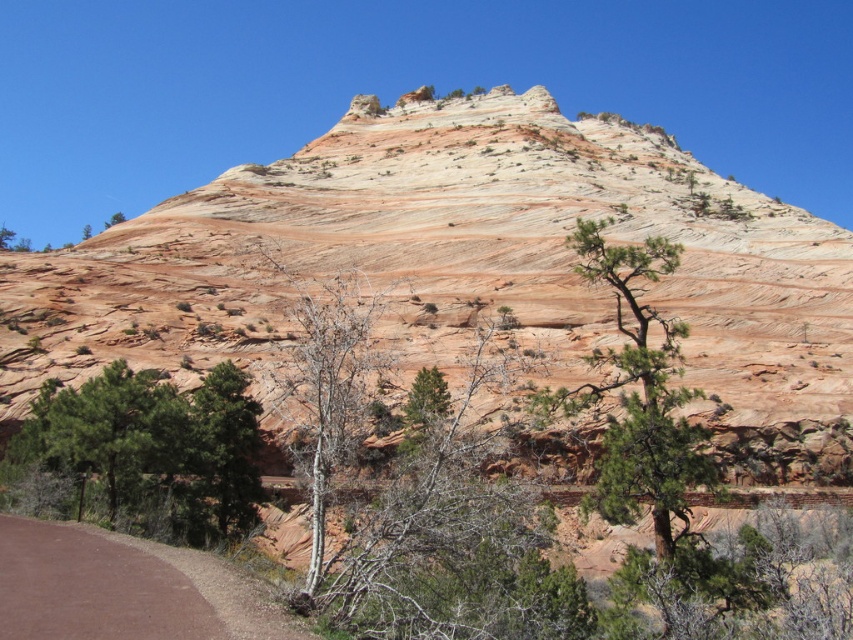
Question: Among these points, which one is nearest to the camera?

Choices:
 (A) (233, 520)
 (B) (610, 488)
 (C) (186, 292)

Answer: (B)

Question: Which of these objects is positioned farthest from the rustic sandstone mountain at center?

Choices:
 (A) bare wood tree at center
 (B) brown dirt path at lower left
 (C) green textured tree at center
 (D) green leafy tree at lower left

Answer: (B)

Question: Where is green matte tree at lower left located in relation to green textured tree at center in the image?

Choices:
 (A) below
 (B) above

Answer: (A)

Question: Is rustic sandstone mountain at center positioned before green leafy tree at lower left?

Choices:
 (A) yes
 (B) no

Answer: (A)

Question: Which point is closer to the camera taking this photo?

Choices:
 (A) (181, 515)
 (B) (0, 243)
 (C) (486, 276)

Answer: (A)

Question: Is green matte tree at lower left wider than brown dirt path at lower left?

Choices:
 (A) yes
 (B) no

Answer: (A)